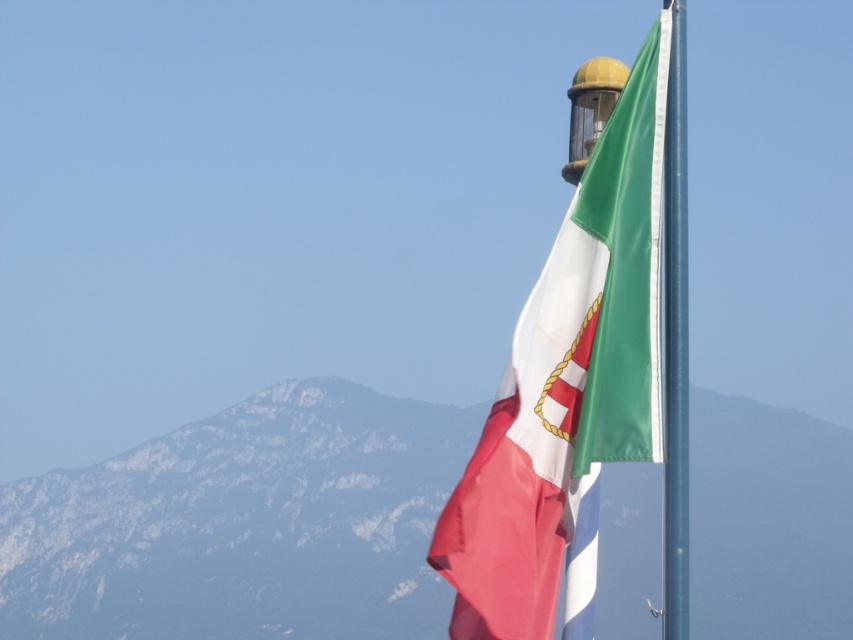
Does matte fabric flag at upper right come in front of metallic flag pole at right?

Yes, matte fabric flag at upper right is closer to the viewer.

Who is positioned more to the left, matte fabric flag at upper right or metallic flag pole at right?

matte fabric flag at upper right is more to the left.

Which is behind, point (506, 609) or point (675, 12)?

Positioned behind is point (675, 12).

At what (x,y) coordinates should I click in order to perform the action: click on matte fabric flag at upper right. Please return your answer as a coordinate pair (x, y). This screenshot has height=640, width=853. Looking at the image, I should click on (567, 388).

The image size is (853, 640). What do you see at coordinates (242, 525) in the screenshot? I see `rocky mountain at center` at bounding box center [242, 525].

Can you confirm if rocky mountain at center is positioned to the left of matte fabric flag at upper right?

Indeed, rocky mountain at center is positioned on the left side of matte fabric flag at upper right.

Which is behind, point (416, 461) or point (525, 545)?

Positioned behind is point (416, 461).

The height and width of the screenshot is (640, 853). I want to click on rocky mountain at center, so click(242, 525).

Is rocky mountain at center closer to camera compared to metallic flag pole at right?

No, it is behind metallic flag pole at right.

Is rocky mountain at center to the right of metallic flag pole at right from the viewer's perspective?

Incorrect, rocky mountain at center is not on the right side of metallic flag pole at right.

The width and height of the screenshot is (853, 640). What do you see at coordinates (242, 525) in the screenshot? I see `rocky mountain at center` at bounding box center [242, 525].

I want to click on rocky mountain at center, so click(242, 525).